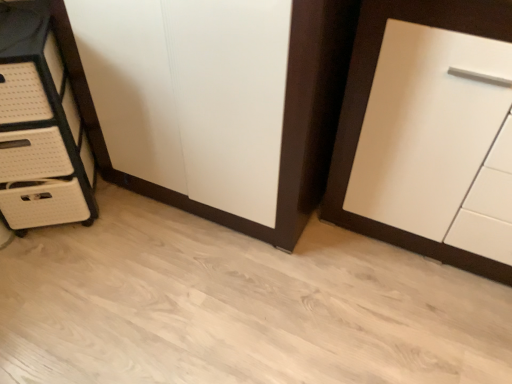
Question: Can you confirm if white woven chest of drawers at left is shorter than white matte cupboard at right?

Choices:
 (A) yes
 (B) no

Answer: (A)

Question: Is white woven chest of drawers at left smaller than white matte cupboard at right?

Choices:
 (A) yes
 (B) no

Answer: (A)

Question: From the image's perspective, is white woven chest of drawers at left over white matte cupboard at right?

Choices:
 (A) no
 (B) yes

Answer: (B)

Question: Considering the relative sizes of white woven chest of drawers at left and white matte cupboard at right in the image provided, is white woven chest of drawers at left taller than white matte cupboard at right?

Choices:
 (A) yes
 (B) no

Answer: (B)

Question: Is white woven chest of drawers at left positioned with its back to white matte cupboard at right?

Choices:
 (A) no
 (B) yes

Answer: (A)

Question: Is white woven chest of drawers at left to the left of white matte cupboard at right from the viewer's perspective?

Choices:
 (A) no
 (B) yes

Answer: (B)

Question: From the image's perspective, is white matte cupboard at right located above white woven chest of drawers at left?

Choices:
 (A) no
 (B) yes

Answer: (A)

Question: Considering the relative positions of white matte cupboard at right and white woven chest of drawers at left in the image provided, is white matte cupboard at right to the left of white woven chest of drawers at left from the viewer's perspective?

Choices:
 (A) no
 (B) yes

Answer: (A)

Question: Is white matte cupboard at right outside of white woven chest of drawers at left?

Choices:
 (A) no
 (B) yes

Answer: (B)

Question: Is white matte cupboard at right oriented away from white woven chest of drawers at left?

Choices:
 (A) no
 (B) yes

Answer: (A)

Question: From the image's perspective, is white matte cupboard at right beneath white woven chest of drawers at left?

Choices:
 (A) yes
 (B) no

Answer: (A)

Question: Considering the relative sizes of white matte cupboard at right and white woven chest of drawers at left in the image provided, is white matte cupboard at right wider than white woven chest of drawers at left?

Choices:
 (A) no
 (B) yes

Answer: (B)

Question: Is white woven chest of drawers at left wider or thinner than white matte cupboard at right?

Choices:
 (A) thin
 (B) wide

Answer: (A)